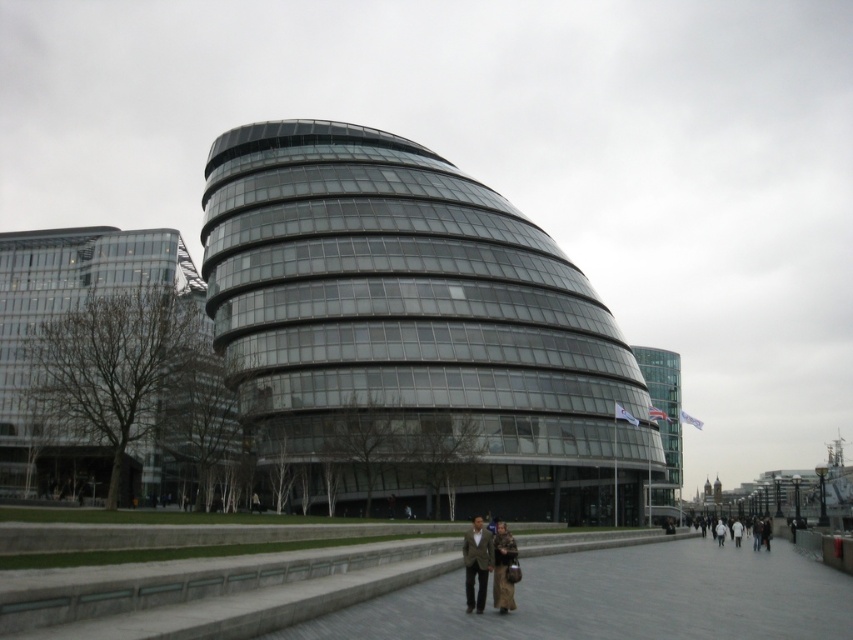
Is brown textured coat at center positioned at the back of matte brown coat at center?

No, brown textured coat at center is closer to the viewer.

The height and width of the screenshot is (640, 853). What do you see at coordinates (503, 568) in the screenshot? I see `brown textured coat at center` at bounding box center [503, 568].

Find the location of a particular element. The image size is (853, 640). brown textured coat at center is located at coordinates (503, 568).

Is brown leather coat at center above brown textured coat at center?

No.

Which is more to the right, brown leather coat at center or brown textured coat at center?

From the viewer's perspective, brown textured coat at center appears more on the right side.

Who is more distant from viewer, (483, 596) or (502, 563)?

The point (502, 563) is more distant.

Identify the location of brown leather coat at center. This screenshot has height=640, width=853. (488, 564).

Does transparent glass building at center appear over brown leather coat at center?

Yes.

Is transparent glass building at center in front of brown leather coat at center?

That is False.

Between point (453, 461) and point (474, 598), which one is positioned in front?

Point (474, 598) is in front.

At what (x,y) coordinates should I click in order to perform the action: click on transparent glass building at center. Please return your answer as a coordinate pair (x, y). This screenshot has height=640, width=853. Looking at the image, I should click on pyautogui.click(x=416, y=336).